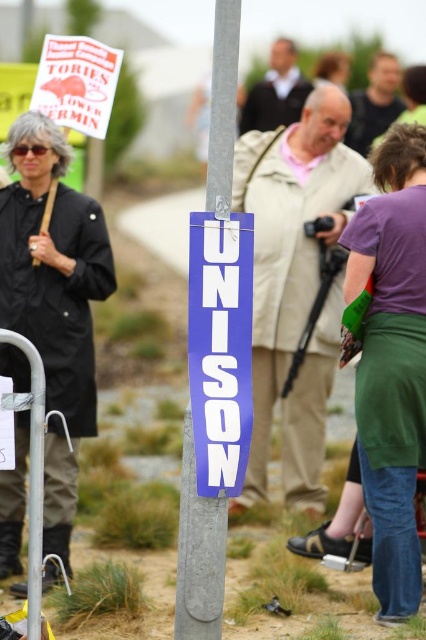
What do you see at coordinates (54, 300) in the screenshot? The image size is (426, 640). I see `black matte coat at left` at bounding box center [54, 300].

Is black matte coat at left positioned in front of purple vinyl banner at center?

That is False.

Which is in front, point (37, 280) or point (209, 442)?

Point (209, 442) is more forward.

At what (x,y) coordinates should I click in order to perform the action: click on black matte coat at left. Please return your answer as a coordinate pair (x, y). Looking at the image, I should click on (54, 300).

Is black matte coat at left thinner than metallic gray pole at center?

No.

Is point (57, 173) positioned in front of point (230, 186)?

No, (57, 173) is further to viewer.

The width and height of the screenshot is (426, 640). I want to click on black matte coat at left, so click(54, 300).

Is black matte coat at left above purple fabric skirt at lower right?

Indeed, black matte coat at left is positioned over purple fabric skirt at lower right.

Find the location of a particular element. black matte coat at left is located at coordinates (54, 300).

The width and height of the screenshot is (426, 640). I want to click on black matte coat at left, so click(54, 300).